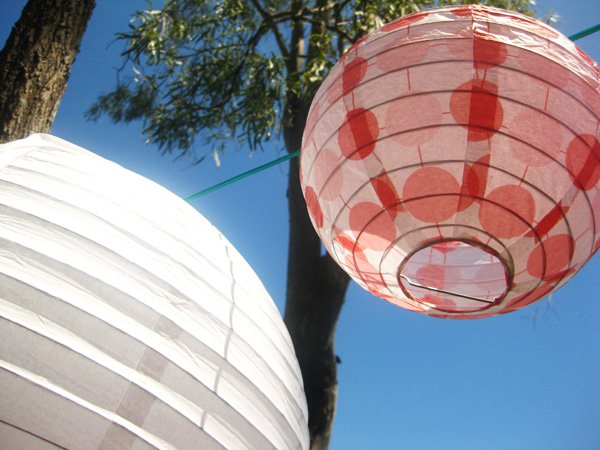
Where is `wire at bottom of lantern`? wire at bottom of lantern is located at coordinates (441, 290).